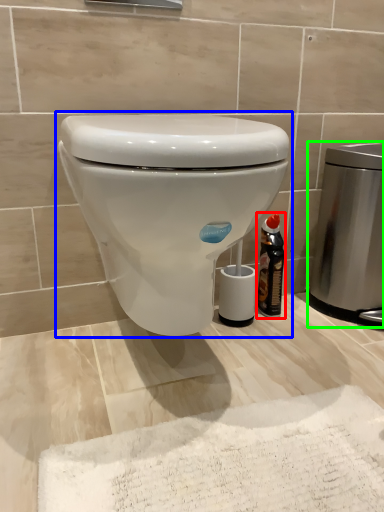
Question: Which object is the farthest from bottle (highlighted by a red box)? Choose among these: toilet (highlighted by a blue box) or appliance (highlighted by a green box).

Choices:
 (A) toilet
 (B) appliance

Answer: (A)